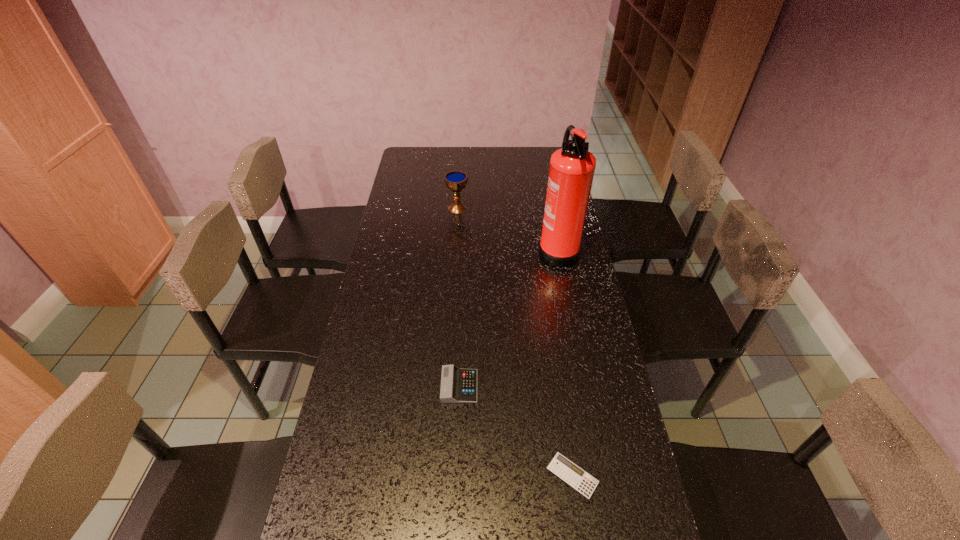
Where is `empty space that is in between the third nearest object and the farther calculator`? empty space that is in between the third nearest object and the farther calculator is located at coordinates (508, 318).

I want to click on unoccupied position between the shorter calculator and the farther calculator, so click(x=516, y=431).

Locate an element on the screen. vacant point located between the third tallest object and the farthest object is located at coordinates (458, 297).

Where is `free space between the chalice and the shortest object`? The width and height of the screenshot is (960, 540). free space between the chalice and the shortest object is located at coordinates tap(515, 341).

This screenshot has width=960, height=540. Identify the location of empty space that is in between the shorter calculator and the tallest object. (565, 362).

The image size is (960, 540). Find the location of `free space between the chalice and the right calculator`. free space between the chalice and the right calculator is located at coordinates (515, 341).

What are the coordinates of `free space between the shortest object and the fire extinguisher` in the screenshot? It's located at (565, 362).

Locate an element on the screen. This screenshot has width=960, height=540. vacant area between the fire extinguisher and the second shortest object is located at coordinates (508, 318).

You are a GUI agent. You are given a task and a screenshot of the screen. Output one action in this format:
    pyautogui.click(x=<x>, y=<y>)
    Task: Click on the blank region between the shorter calculator and the chalice
    
    Given the screenshot: What is the action you would take?
    pyautogui.click(x=515, y=341)

You are a GUI agent. You are given a task and a screenshot of the screen. Output one action in this format:
    pyautogui.click(x=<x>, y=<y>)
    Task: Click on the vacant region between the farthest object and the nearest object
    
    Given the screenshot: What is the action you would take?
    pyautogui.click(x=515, y=341)